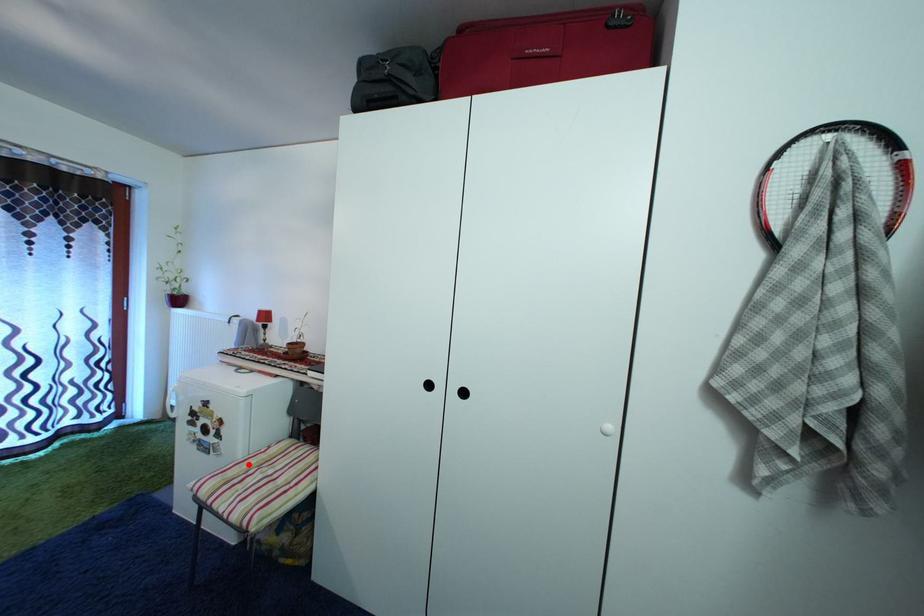
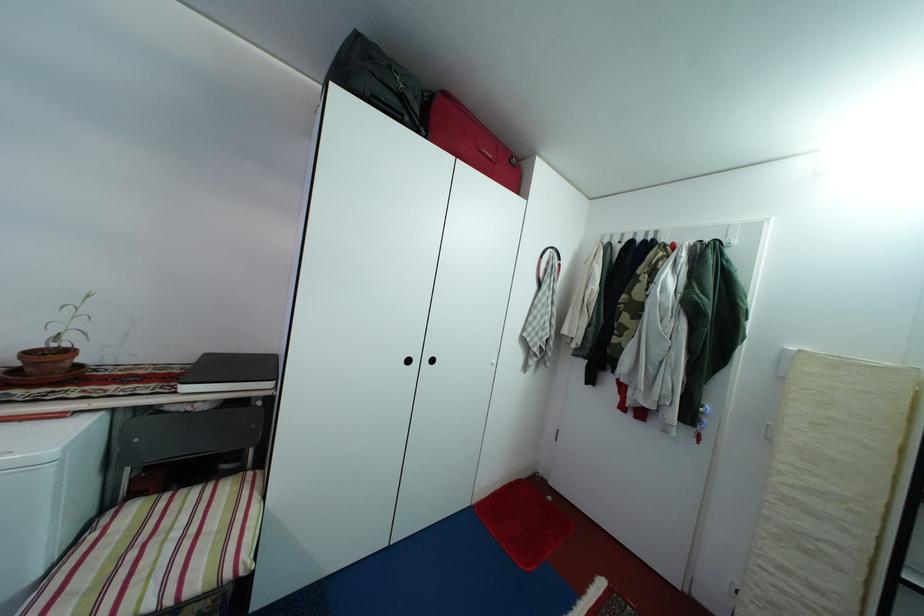
Question: I am providing you with two images of the same scene from different viewpoints. A red point is shown in image1. For the corresponding object point in image2, is it positioned nearer or farther from the camera?

Choices:
 (A) Nearer
 (B) Farther

Answer: (A)